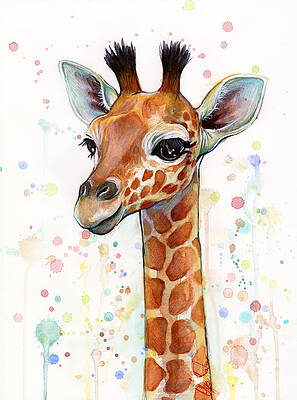
What are the coordinates of `artwall` in the screenshot? It's located at (220, 236).